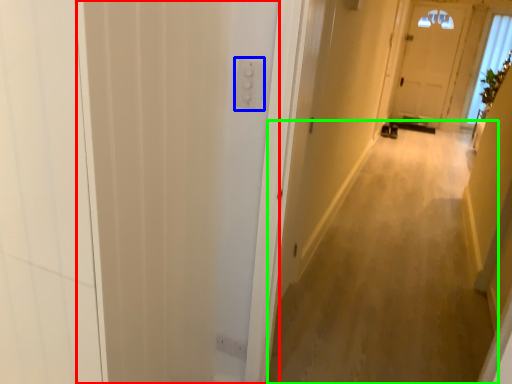
Question: Estimate the real-world distances between objects in this image. Which object is farther from screen door (highlighted by a red box), electric outlet (highlighted by a blue box) or corridor (highlighted by a green box)?

Choices:
 (A) electric outlet
 (B) corridor

Answer: (B)